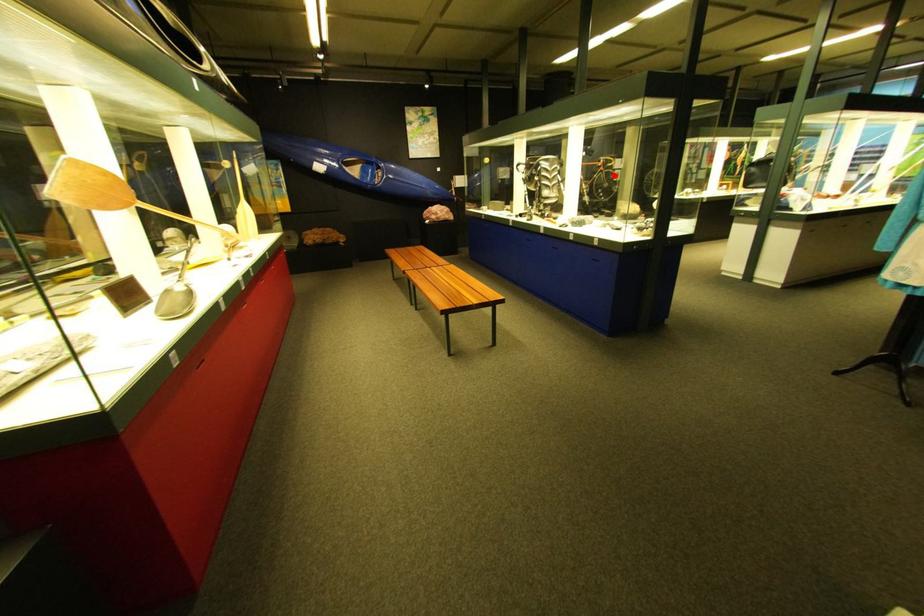
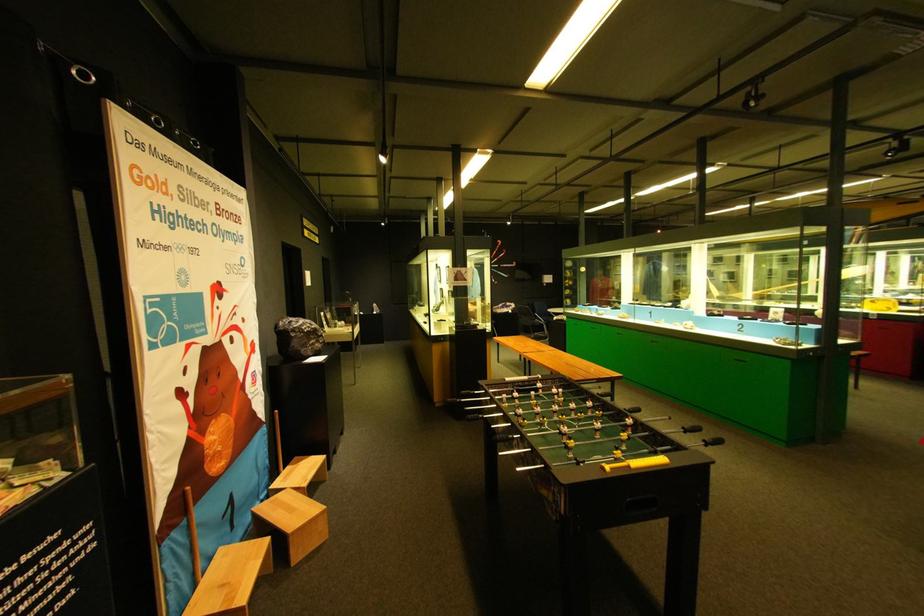
Question: I am providing you with two images of the same scene from different viewpoints. A red point is marked on the first image. Is the red point's position out of view in image 2?

Choices:
 (A) Yes
 (B) No

Answer: (A)